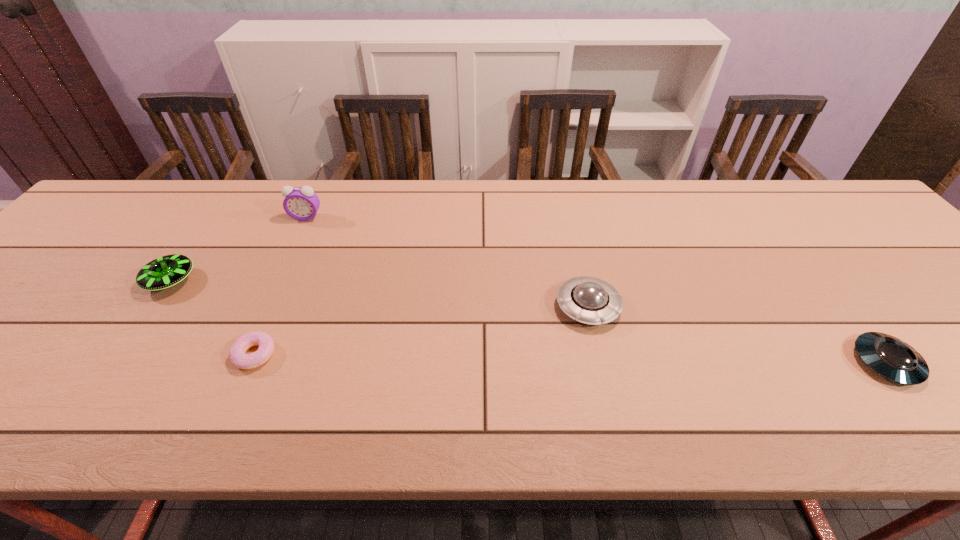
This screenshot has width=960, height=540. I want to click on vacant region between the second saucer from left to right and the leftmost object, so click(x=379, y=294).

Locate an element on the screen. This screenshot has height=540, width=960. vacant space that's between the leftmost saucer and the alarm clock is located at coordinates (239, 249).

This screenshot has height=540, width=960. I want to click on vacant space that's between the second saucer from left to right and the shortest saucer, so click(x=736, y=334).

Where is `empty location between the doughnut and the tallest object`? empty location between the doughnut and the tallest object is located at coordinates (280, 286).

The image size is (960, 540). What are the coordinates of `free space between the second saucer from right to left and the leftmost object` in the screenshot? It's located at (379, 294).

In order to click on unoccupied position between the tallest object and the shortest object in this screenshot , I will do `click(280, 286)`.

Where is `free spot between the shortest saucer and the leftmost object`? The width and height of the screenshot is (960, 540). free spot between the shortest saucer and the leftmost object is located at coordinates (528, 322).

Point out which object is positioned as the third nearest to the farthest object. Please provide its 2D coordinates. Your answer should be formatted as a tuple, i.e. [(x, y)], where the tuple contains the x and y coordinates of a point satisfying the conditions above.

[(589, 300)]

Identify which object is the closest to the alarm clock. Please provide its 2D coordinates. Your answer should be formatted as a tuple, i.e. [(x, y)], where the tuple contains the x and y coordinates of a point satisfying the conditions above.

[(167, 271)]

At what (x,y) coordinates should I click in order to perform the action: click on saucer that is the second nearest to the rightmost object. Please return your answer as a coordinate pair (x, y). Image resolution: width=960 pixels, height=540 pixels. Looking at the image, I should click on (167, 271).